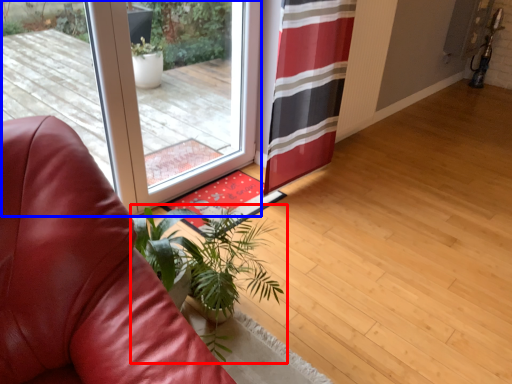
Question: Among these objects, which one is farthest to the camera, houseplant (highlighted by a red box) or door (highlighted by a blue box)?

Choices:
 (A) houseplant
 (B) door

Answer: (B)